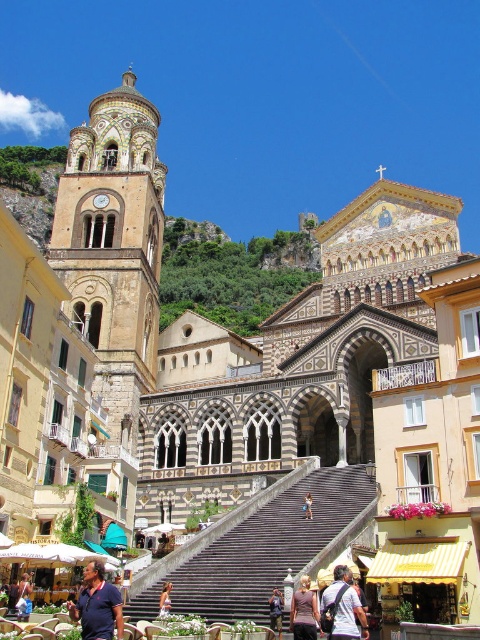
You are standing at the entrance of the cathedral and see both the black stone stairs at center and the blue denim jeans at center. Which object is closer to you?

The black stone stairs at center are closer to you because the blue denim jeans at center is behind them.

You are standing in front of the grand cathedral with its ornate bell tower on the left. You notice both the black stone stairs at center and the blue denim jeans at center. From your vantage point, which object is positioned higher?

The black stone stairs at center is located above the blue denim jeans at center, so the black stone stairs at center is higher.